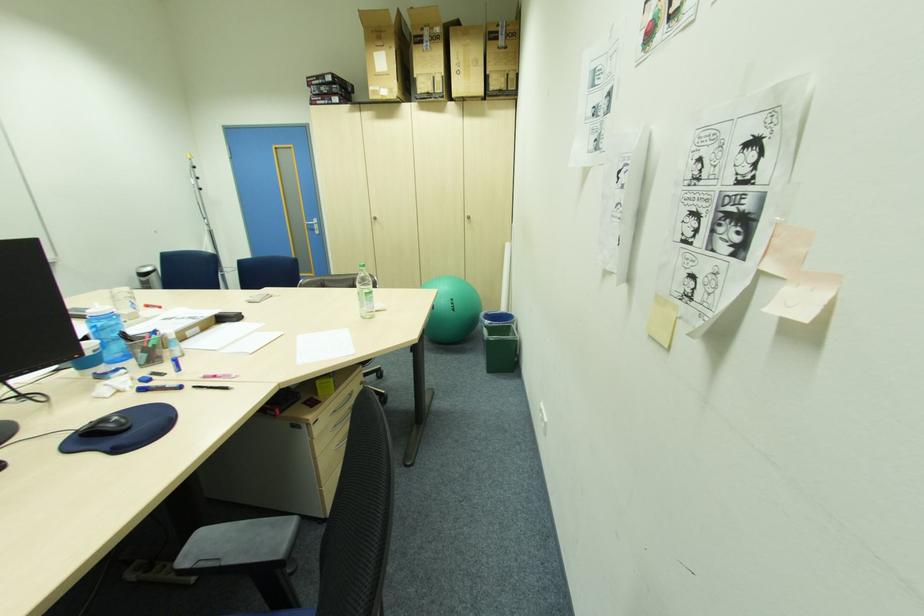
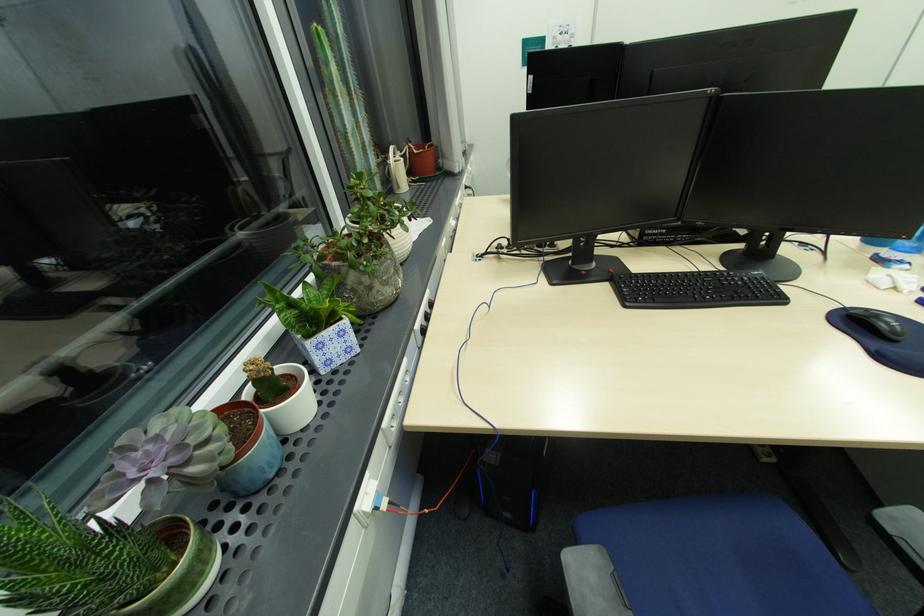
In the second image, find the point that corresponds to pixel 88 431 in the first image.

(857, 312)